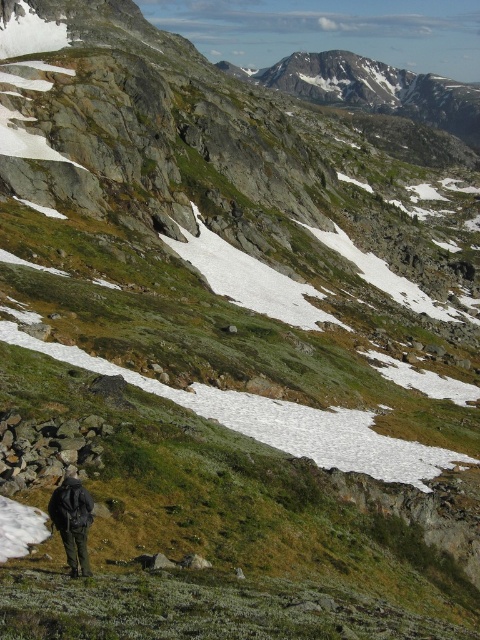
Is rusty metallic rocks at lower left thinner than dark green jacket at lower left?

Yes, rusty metallic rocks at lower left is thinner than dark green jacket at lower left.

Who is lower down, rusty metallic rocks at lower left or dark green jacket at lower left?

dark green jacket at lower left

The width and height of the screenshot is (480, 640). In order to click on rusty metallic rocks at lower left in this screenshot , I will do `click(47, 449)`.